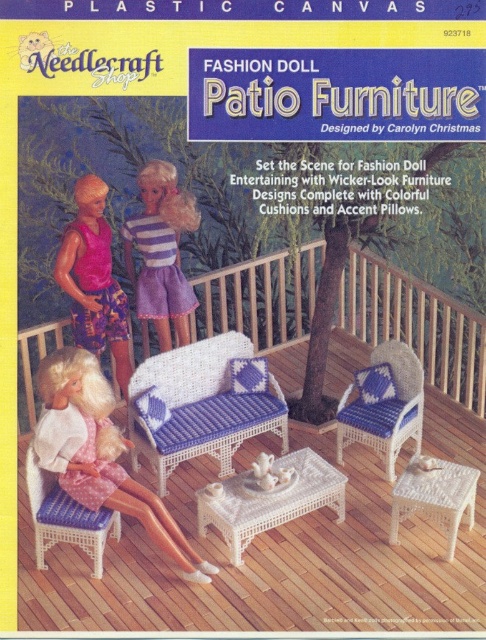
Question: Based on their relative distances, which object is nearer to the pink fabric doll at upper center?

Choices:
 (A) white wicker table at center
 (B) wicker blue cushioned chair at center
 (C) white wicker bench at center
 (D) striped fabric dress at center

Answer: (D)

Question: Can you confirm if white wicker chair at lower left is positioned to the left of white wicker bench at center?

Choices:
 (A) yes
 (B) no

Answer: (A)

Question: Which object appears closest to the camera in this image?

Choices:
 (A) wicker blue cushioned chair at center
 (B) matte wicker stool at lower left

Answer: (B)

Question: Which of the following is the closest to the observer?

Choices:
 (A) (155, 230)
 (B) (44, 413)
 (C) (354, 428)

Answer: (B)

Question: Where is wicker blue cushioned chair at center located in relation to white wicker stool at lower right in the image?

Choices:
 (A) right
 (B) left

Answer: (B)

Question: Is white wicker chair at lower left bigger than white wicker table at center?

Choices:
 (A) no
 (B) yes

Answer: (B)